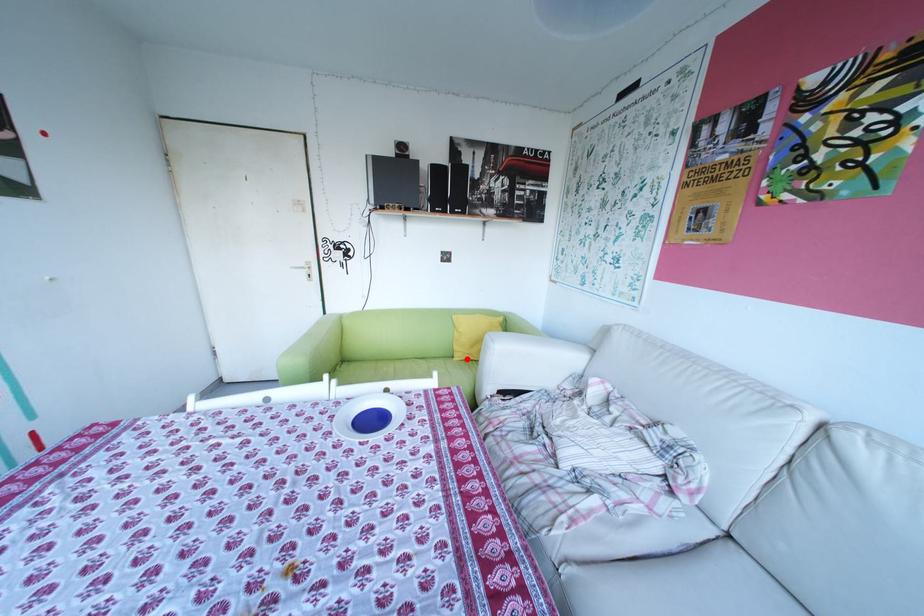
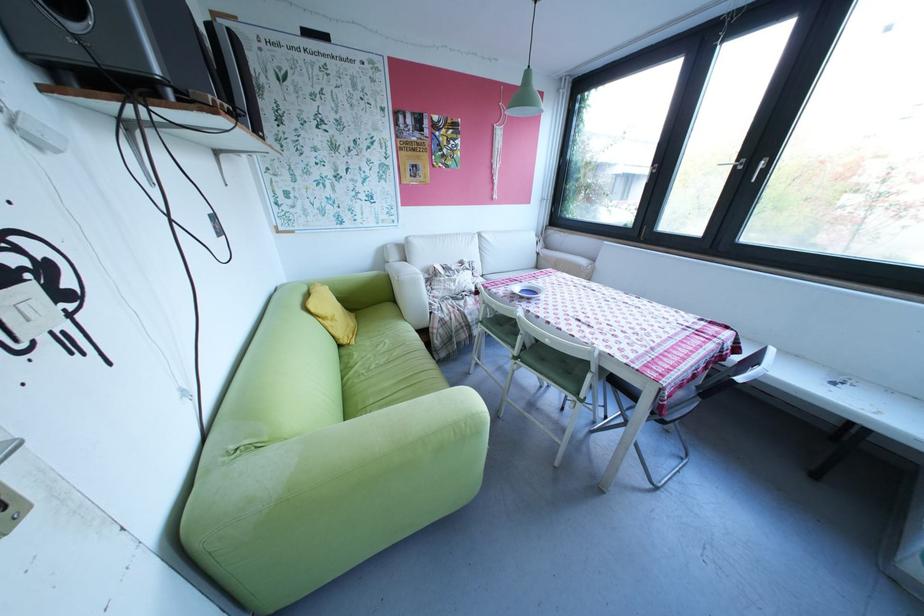
In the second image, find the point that corresponds to the highlighted location in the first image.

(366, 342)